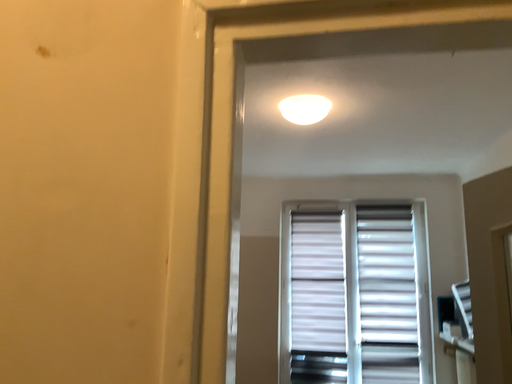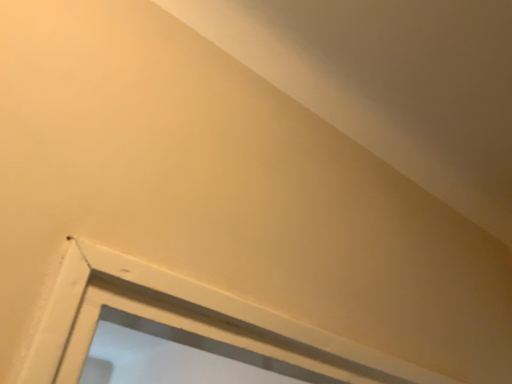
Question: How did the camera likely rotate when shooting the video?

Choices:
 (A) rotated upward
 (B) rotated downward

Answer: (A)